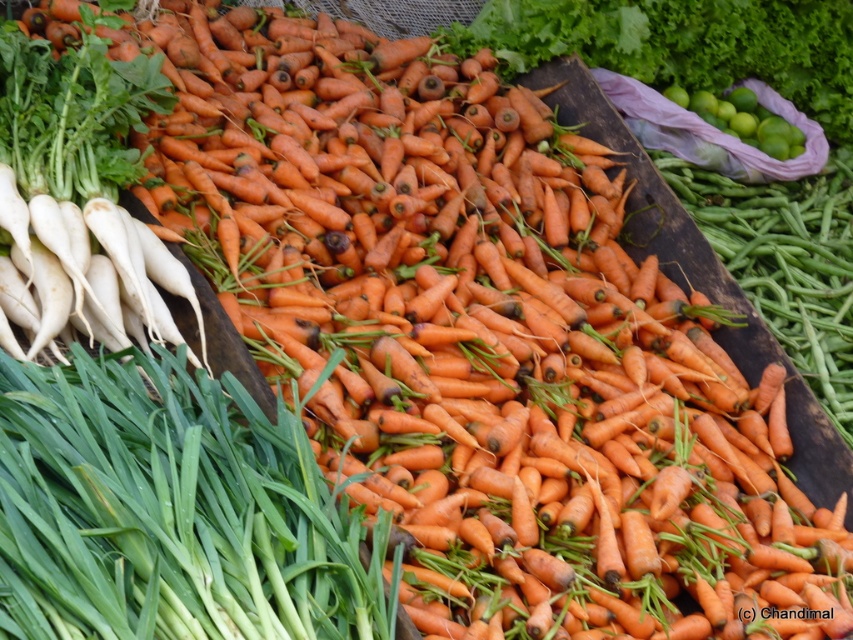
Question: Estimate the real-world distances between objects in this image. Which object is closer to the orange matte carrots at upper center?

Choices:
 (A) orange matte carrot at center-right
 (B) white smooth radish at left
 (C) green matte lime at upper right

Answer: (C)

Question: Among these objects, which one is farthest from the camera?

Choices:
 (A) green leafy at lower left
 (B) white smooth radish at left
 (C) green matte lime at upper right
 (D) orange matte carrots at upper center

Answer: (C)

Question: Is green leafy at lower left to the left of white smooth radish at left from the viewer's perspective?

Choices:
 (A) yes
 (B) no

Answer: (B)

Question: Which of the following is the closest to the observer?

Choices:
 (A) (62, 392)
 (B) (782, 220)

Answer: (A)

Question: Is orange matte carrots at upper center above green matte lime at upper right?

Choices:
 (A) no
 (B) yes

Answer: (B)

Question: Is the position of white smooth radish at left more distant than that of orange matte carrots at upper center?

Choices:
 (A) no
 (B) yes

Answer: (A)